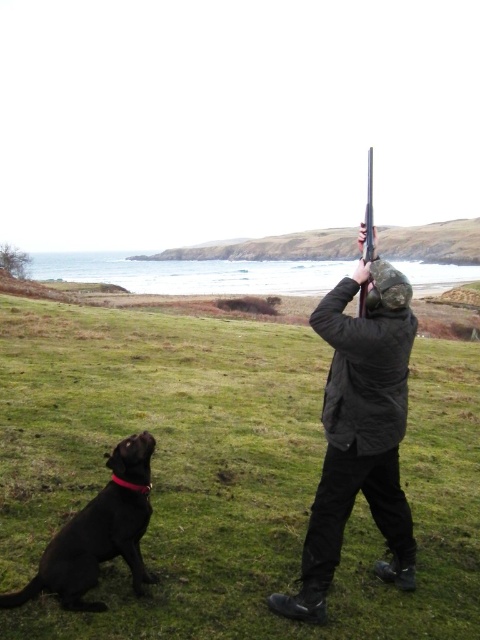
You are a photographer trying to capture the black matte jacket at center and the polished wood shotgun at upper center in a single frame. Given their sizes, which object would you need to position closer to the camera to ensure both are clearly visible in the photo?

Since the black matte jacket at center occupies less space than the polished wood shotgun at upper center, you would need to position the black matte jacket at center closer to the camera to ensure both objects are clearly visible in the photo.

You are a photographer trying to capture a clear shot of the black matte jacket at center and the polished wood shotgun at upper center. Which object should you focus on first to ensure both are in focus, considering their positions?

The black matte jacket at center is below the polished wood shotgun at upper center, so you should focus on the polished wood shotgun at upper center first since it is closer to the camera.